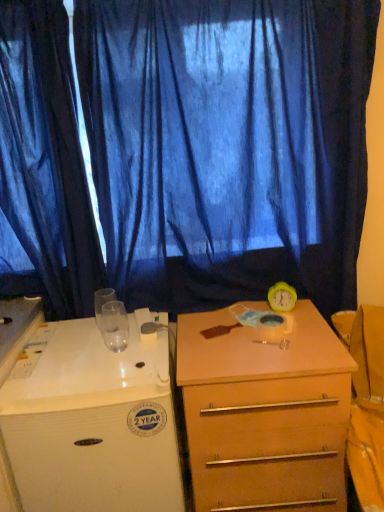
In order to face blue sheer curtain at left, which appears as the second curtain when viewed from the right, should I rotate leftwards or rightwards?

Turn left by 20.595 degrees to look at blue sheer curtain at left, which appears as the second curtain when viewed from the right.

This screenshot has height=512, width=384. In order to click on white glossy desk at left in this screenshot , I will do `click(93, 425)`.

Where is `blue sheer curtain at left, which appears as the second curtain when viewed from the right`? The width and height of the screenshot is (384, 512). blue sheer curtain at left, which appears as the second curtain when viewed from the right is located at coordinates (46, 156).

Looking at this image, is light brown wood drawer at center touching blue sheer curtain at upper center, the first curtain in the right-to-left sequence?

No, light brown wood drawer at center is not making contact with blue sheer curtain at upper center, the first curtain in the right-to-left sequence.

Is the depth of light brown wood drawer at center greater than that of blue sheer curtain at upper center, which is the second curtain in left-to-right order?

No, light brown wood drawer at center is in front of blue sheer curtain at upper center, which is the second curtain in left-to-right order.

Is light brown wood drawer at center located outside blue sheer curtain at upper center, the first curtain in the right-to-left sequence?

Yes, light brown wood drawer at center is located beyond the bounds of blue sheer curtain at upper center, the first curtain in the right-to-left sequence.

From the image's perspective, which one is positioned higher, light brown wood drawer at center or blue sheer curtain at left, which appears as the second curtain when viewed from the right?

blue sheer curtain at left, which appears as the second curtain when viewed from the right, is shown above in the image.

Considering the positions of objects light brown wood drawer at center and blue sheer curtain at left, which appears as the second curtain when viewed from the right, in the image provided, who is more to the left, light brown wood drawer at center or blue sheer curtain at left, which appears as the second curtain when viewed from the right,?

From the viewer's perspective, blue sheer curtain at left, which appears as the second curtain when viewed from the right, appears more on the left side.

In the image, is light brown wood drawer at center positioned in front of or behind blue sheer curtain at left, which appears as the second curtain when viewed from the right?

light brown wood drawer at center is in front of blue sheer curtain at left, which appears as the second curtain when viewed from the right.

Does point (279, 432) lie in front of point (57, 45)?

That is True.

Can you tell me how much white glossy desk at left and blue sheer curtain at left, which appears as the second curtain when viewed from the right, differ in facing direction?

They differ by 0.454 degrees in their facing directions.

Which of these two, white glossy desk at left or blue sheer curtain at left, which is counted as the first curtain, starting from the left, is thinner?

blue sheer curtain at left, which is counted as the first curtain, starting from the left.

From the image's perspective, which one is positioned lower, white glossy desk at left or blue sheer curtain at left, which appears as the second curtain when viewed from the right?

white glossy desk at left is shown below in the image.

From a real-world perspective, starting from the white glossy desk at left, which curtain is the 1st one vertically above it? Please provide its 2D coordinates.

[(46, 156)]

From the image's perspective, would you say white glossy desk at left is shown under light brown wood drawer at center?

Yes, from the image's perspective, white glossy desk at left is below light brown wood drawer at center.

How different are the orientations of white glossy desk at left and light brown wood drawer at center in degrees?

The angle between the facing direction of white glossy desk at left and the facing direction of light brown wood drawer at center is 0.193 degrees.

Does point (64, 332) come behind point (254, 410)?

Yes.

Is light brown wood drawer at center completely or partially inside white glossy desk at left?

Definitely not — light brown wood drawer at center is not inside white glossy desk at left.

Can you see white glossy desk at left touching blue sheer curtain at upper center, which is the second curtain in left-to-right order?

white glossy desk at left and blue sheer curtain at upper center, which is the second curtain in left-to-right order, are not in contact.

Looking at this image, is white glossy desk at left positioned before blue sheer curtain at upper center, which is the second curtain in left-to-right order?

Yes, white glossy desk at left is closer to the viewer.

Does white glossy desk at left have a larger size compared to blue sheer curtain at upper center, the first curtain in the right-to-left sequence?

Correct, white glossy desk at left is larger in size than blue sheer curtain at upper center, the first curtain in the right-to-left sequence.

Would you say white glossy desk at left is to the left or to the right of blue sheer curtain at upper center, which is the second curtain in left-to-right order, in the picture?

In the image, white glossy desk at left appears on the left side of blue sheer curtain at upper center, which is the second curtain in left-to-right order.

Can you confirm if light brown wood drawer at center is wider than white glossy desk at left?

Incorrect, the width of light brown wood drawer at center does not surpass that of white glossy desk at left.

From the image's perspective, does light brown wood drawer at center appear higher than white glossy desk at left?

Yes, from the image's perspective, light brown wood drawer at center is above white glossy desk at left.

Does point (257, 496) come in front of point (119, 384)?

That is False.

Does point (34, 79) lie behind point (14, 158)?

No.

Considering the relative positions of blue sheer curtain at left, which is counted as the first curtain, starting from the left, and blue sheer curtain at upper center, the first curtain in the right-to-left sequence, in the image provided, is blue sheer curtain at left, which is counted as the first curtain, starting from the left, to the left of blue sheer curtain at upper center, the first curtain in the right-to-left sequence, from the viewer's perspective?

Indeed, blue sheer curtain at left, which is counted as the first curtain, starting from the left, is positioned on the left side of blue sheer curtain at upper center, the first curtain in the right-to-left sequence.

Consider the image. From a real-world perspective, which object stands above the other?

blue sheer curtain at upper center, which is the second curtain in left-to-right order, from a real-world perspective.

From a real-world perspective, which curtain is the 2nd one above the light brown wood drawer at center? Please provide its 2D coordinates.

[(184, 150)]

Locate an element on the screen. curtain that is the 2nd one when counting leftward from the light brown wood drawer at center is located at coordinates (46, 156).

Looking at this image, from the image, which object appears to be nearer to blue sheer curtain at upper center, which is the second curtain in left-to-right order, light brown wood drawer at center or white glossy desk at left?

white glossy desk at left is closer to blue sheer curtain at upper center, which is the second curtain in left-to-right order.

Estimate the real-world distances between objects in this image. Which object is closer to blue sheer curtain at upper center, the first curtain in the right-to-left sequence, white glossy desk at left or blue sheer curtain at left, which appears as the second curtain when viewed from the right?

Based on the image, blue sheer curtain at left, which appears as the second curtain when viewed from the right, appears to be nearer to blue sheer curtain at upper center, the first curtain in the right-to-left sequence.

When comparing their distances from blue sheer curtain at left, which appears as the second curtain when viewed from the right, does light brown wood drawer at center or white glossy desk at left seem closer?

white glossy desk at left lies closer to blue sheer curtain at left, which appears as the second curtain when viewed from the right, than the other object.

Estimate the real-world distances between objects in this image. Which object is further from light brown wood drawer at center, white glossy desk at left or blue sheer curtain at left, which is counted as the first curtain, starting from the left?

blue sheer curtain at left, which is counted as the first curtain, starting from the left, is further to light brown wood drawer at center.

Estimate the real-world distances between objects in this image. Which object is closer to light brown wood drawer at center, blue sheer curtain at upper center, the first curtain in the right-to-left sequence, or white glossy desk at left?

Among the two, white glossy desk at left is located nearer to light brown wood drawer at center.

Looking at the image, which one is located further to light brown wood drawer at center, blue sheer curtain at left, which appears as the second curtain when viewed from the right, or white glossy desk at left?

Among the two, blue sheer curtain at left, which appears as the second curtain when viewed from the right, is located further to light brown wood drawer at center.

Estimate the real-world distances between objects in this image. Which object is further from white glossy desk at left, blue sheer curtain at left, which is counted as the first curtain, starting from the left, or blue sheer curtain at upper center, the first curtain in the right-to-left sequence?

The object further to white glossy desk at left is blue sheer curtain at upper center, the first curtain in the right-to-left sequence.

Estimate the real-world distances between objects in this image. Which object is further from blue sheer curtain at left, which is counted as the first curtain, starting from the left, white glossy desk at left or light brown wood drawer at center?

light brown wood drawer at center is further to blue sheer curtain at left, which is counted as the first curtain, starting from the left.

You are a GUI agent. You are given a task and a screenshot of the screen. Output one action in this format:
    pyautogui.click(x=<x>, y=<y>)
    Task: Click on the curtain between blue sheer curtain at upper center, the first curtain in the right-to-left sequence, and white glossy desk at left vertically
    
    Given the screenshot: What is the action you would take?
    click(x=46, y=156)

I want to click on curtain between blue sheer curtain at upper center, the first curtain in the right-to-left sequence, and light brown wood drawer at center, in the vertical direction, so click(x=46, y=156).

You are a GUI agent. You are given a task and a screenshot of the screen. Output one action in this format:
    pyautogui.click(x=<x>, y=<y>)
    Task: Click on the drawer between blue sheer curtain at upper center, the first curtain in the right-to-left sequence, and white glossy desk at left in the up-down direction
    
    Given the screenshot: What is the action you would take?
    pyautogui.click(x=269, y=443)

You are a GUI agent. You are given a task and a screenshot of the screen. Output one action in this format:
    pyautogui.click(x=<x>, y=<y>)
    Task: Click on the drawer between blue sheer curtain at left, which is counted as the first curtain, starting from the left, and white glossy desk at left vertically
    This screenshot has height=512, width=384.
    Given the screenshot: What is the action you would take?
    pyautogui.click(x=269, y=443)